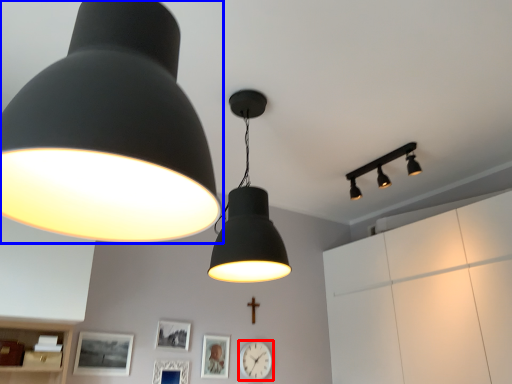
Question: Among these objects, which one is farthest to the camera, clock (highlighted by a red box) or lamp (highlighted by a blue box)?

Choices:
 (A) clock
 (B) lamp

Answer: (A)